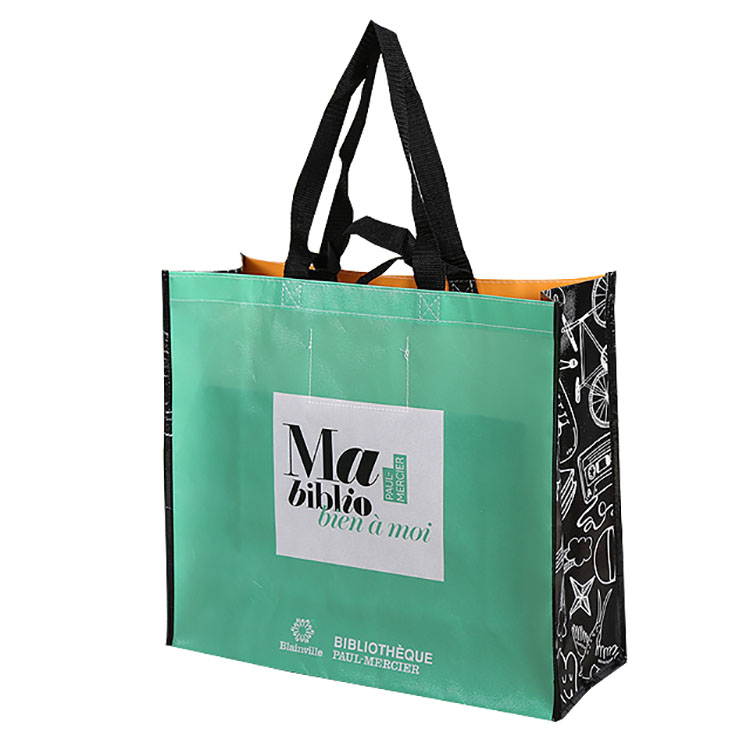
The image size is (750, 750). In order to click on handle in this screenshot , I will do `click(418, 141)`, `click(340, 205)`, `click(390, 236)`.